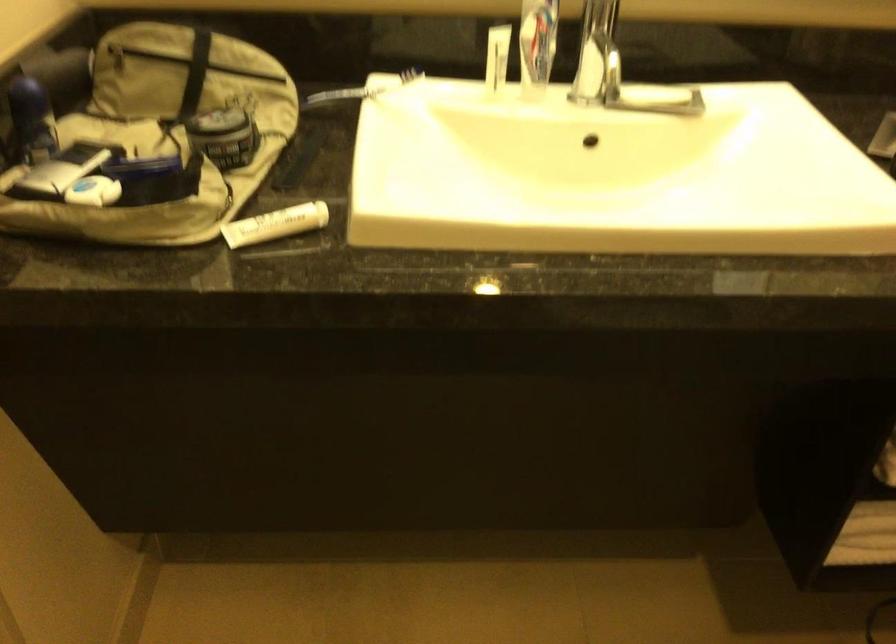
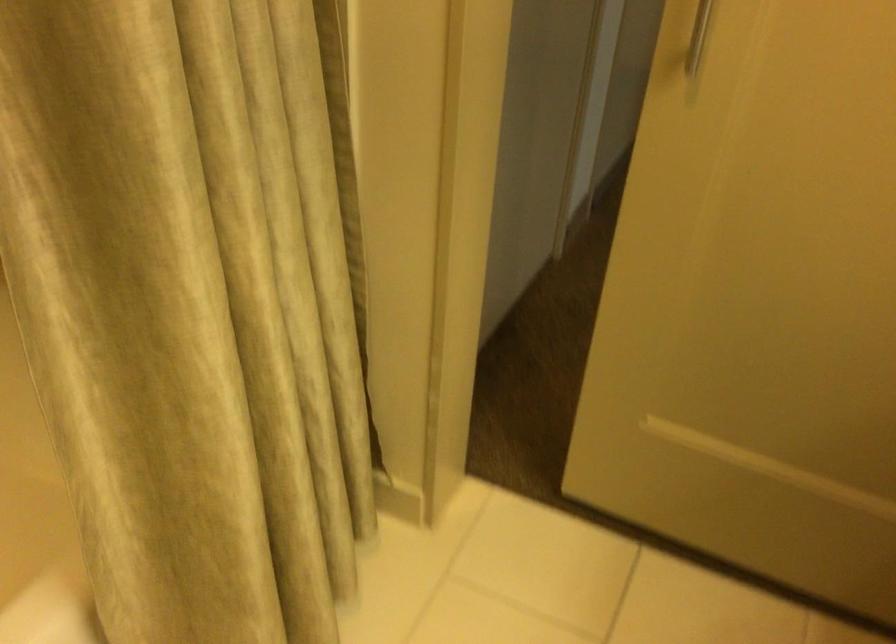
From the picture: Based on the continuous images, in which direction is the camera rotating?

The camera's rotation is toward left-down.